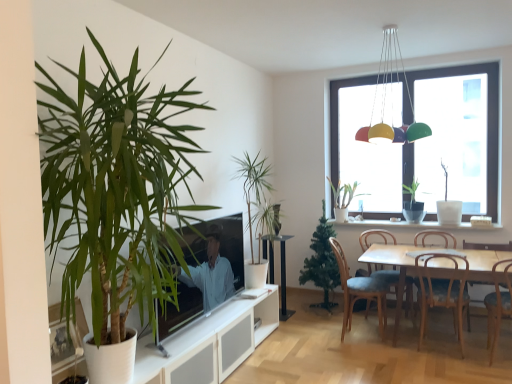
This screenshot has width=512, height=384. I want to click on free space to the left of wooden chair with cushion at lower right, which appears as the 1th chair when viewed from the left, so click(x=310, y=332).